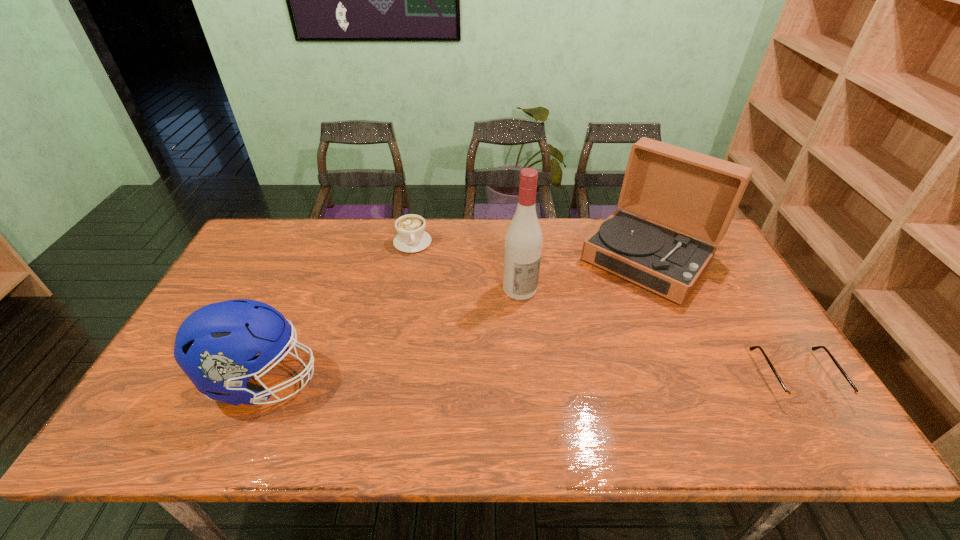
I want to click on vacant space on the desktop that is between the third tallest object and the shortest object and is positioned on the label of the third object from right to left, so click(x=586, y=379).

I want to click on vacant space on the desktop that is between the third shortest object and the spectacles and is positioned to the right of the second shortest object's handle, so click(x=453, y=379).

This screenshot has width=960, height=540. Find the location of `free spot on the desktop that is between the football helmet and the spectacles and is positioned on the face of the fourth shortest object`. free spot on the desktop that is between the football helmet and the spectacles and is positioned on the face of the fourth shortest object is located at coordinates (546, 379).